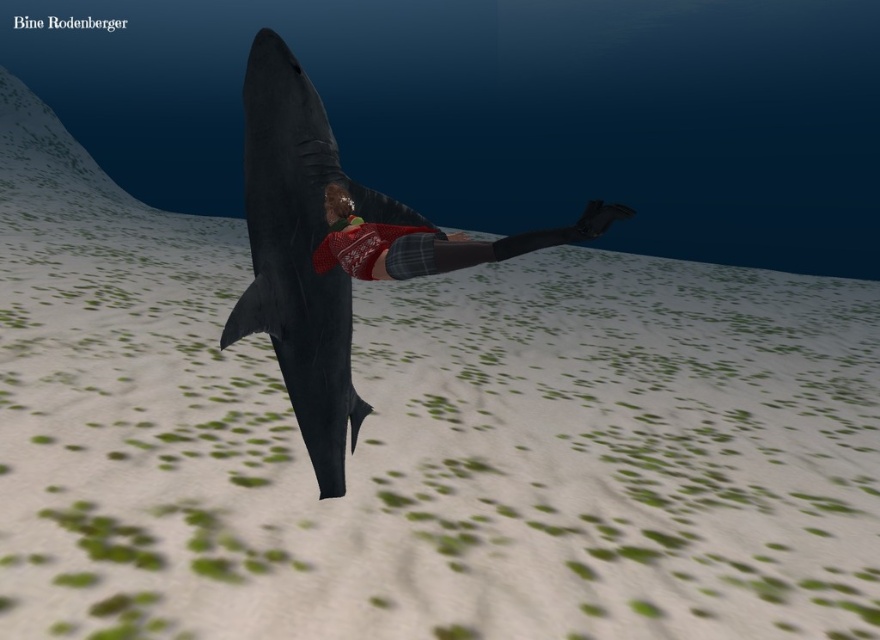
Does shiny black shark at center come in front of sweater at center?

No, shiny black shark at center is behind sweater at center.

Measure the distance between point (266, 113) and camera.

6.67 feet

You are a GUI agent. You are given a task and a screenshot of the screen. Output one action in this format:
    pyautogui.click(x=<x>, y=<y>)
    Task: Click on the shiny black shark at center
    
    Given the screenshot: What is the action you would take?
    pyautogui.click(x=299, y=253)